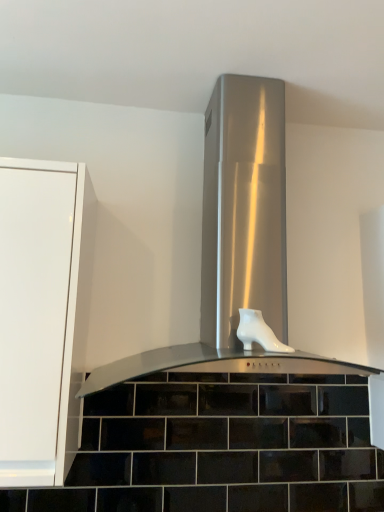
Question: In terms of height, does white glossy boot at center look taller or shorter compared to stainless steel range hood at center?

Choices:
 (A) short
 (B) tall

Answer: (A)

Question: Considering their positions, is white glossy boot at center located in front of or behind stainless steel range hood at center?

Choices:
 (A) behind
 (B) front

Answer: (A)

Question: In terms of width, does white glossy boot at center look wider or thinner when compared to stainless steel range hood at center?

Choices:
 (A) wide
 (B) thin

Answer: (B)

Question: Considering the positions of stainless steel range hood at center and white glossy boot at center in the image, is stainless steel range hood at center taller or shorter than white glossy boot at center?

Choices:
 (A) short
 (B) tall

Answer: (B)

Question: Relative to white glossy boot at center, is stainless steel range hood at center in front or behind?

Choices:
 (A) behind
 (B) front

Answer: (B)

Question: From a real-world perspective, is stainless steel range hood at center above or below white glossy boot at center?

Choices:
 (A) above
 (B) below

Answer: (A)

Question: From the image's perspective, is stainless steel range hood at center located above or below white glossy boot at center?

Choices:
 (A) above
 (B) below

Answer: (A)